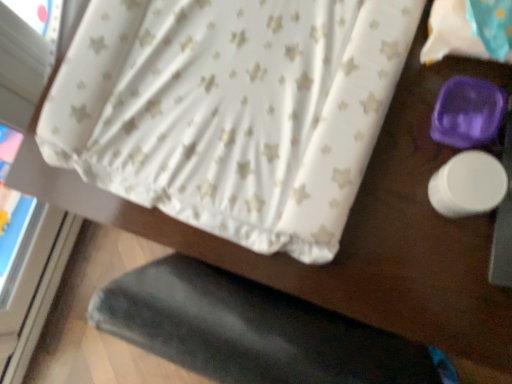
Question: Which direction should I rotate to look at white star-patterned fabric at upper center?

Choices:
 (A) left
 (B) right

Answer: (A)

Question: Does white star-patterned fabric at upper right appear on the left side of white star-patterned fabric at upper center?

Choices:
 (A) no
 (B) yes

Answer: (A)

Question: Is white star-patterned fabric at upper right facing towards white star-patterned fabric at upper center?

Choices:
 (A) no
 (B) yes

Answer: (A)

Question: Is white star-patterned fabric at upper right oriented away from white star-patterned fabric at upper center?

Choices:
 (A) no
 (B) yes

Answer: (A)

Question: From a real-world perspective, is white star-patterned fabric at upper right located beneath white star-patterned fabric at upper center?

Choices:
 (A) no
 (B) yes

Answer: (A)

Question: Is white star-patterned fabric at upper right closer to camera compared to white star-patterned fabric at upper center?

Choices:
 (A) yes
 (B) no

Answer: (A)

Question: Is white star-patterned fabric at upper center inside white star-patterned fabric at upper right?

Choices:
 (A) no
 (B) yes

Answer: (A)

Question: Is white star-patterned fabric at upper center shorter than white star-patterned fabric at upper right?

Choices:
 (A) no
 (B) yes

Answer: (A)

Question: Is white star-patterned fabric at upper center completely or partially outside of white star-patterned fabric at upper right?

Choices:
 (A) no
 (B) yes

Answer: (B)

Question: Is white star-patterned fabric at upper center next to white star-patterned fabric at upper right and touching it?

Choices:
 (A) no
 (B) yes

Answer: (A)

Question: Is white star-patterned fabric at upper center taller than white star-patterned fabric at upper right?

Choices:
 (A) no
 (B) yes

Answer: (B)

Question: Considering the relative sizes of white star-patterned fabric at upper center and white star-patterned fabric at upper right in the image provided, is white star-patterned fabric at upper center bigger than white star-patterned fabric at upper right?

Choices:
 (A) yes
 (B) no

Answer: (A)

Question: From the image's perspective, does white star-patterned fabric at upper center appear higher than white star-patterned fabric at upper right?

Choices:
 (A) yes
 (B) no

Answer: (B)

Question: From the image's perspective, is white star-patterned fabric at upper right positioned above or below white star-patterned fabric at upper center?

Choices:
 (A) below
 (B) above

Answer: (B)